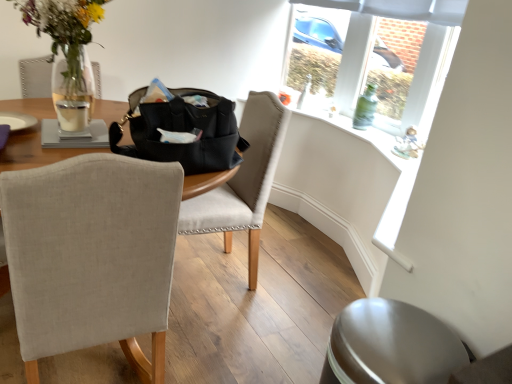
Locate an element on the screen. free space on the front side of light beige fabric chair at center, arranged as the 2th chair when viewed from the front is located at coordinates (226, 340).